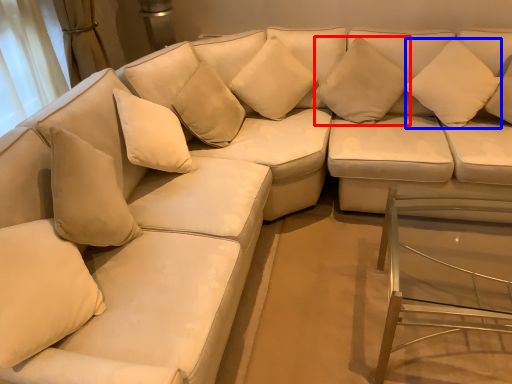
Question: Which object appears closest to the camera in this image, pillow (highlighted by a red box) or pillow (highlighted by a blue box)?

Choices:
 (A) pillow
 (B) pillow

Answer: (B)